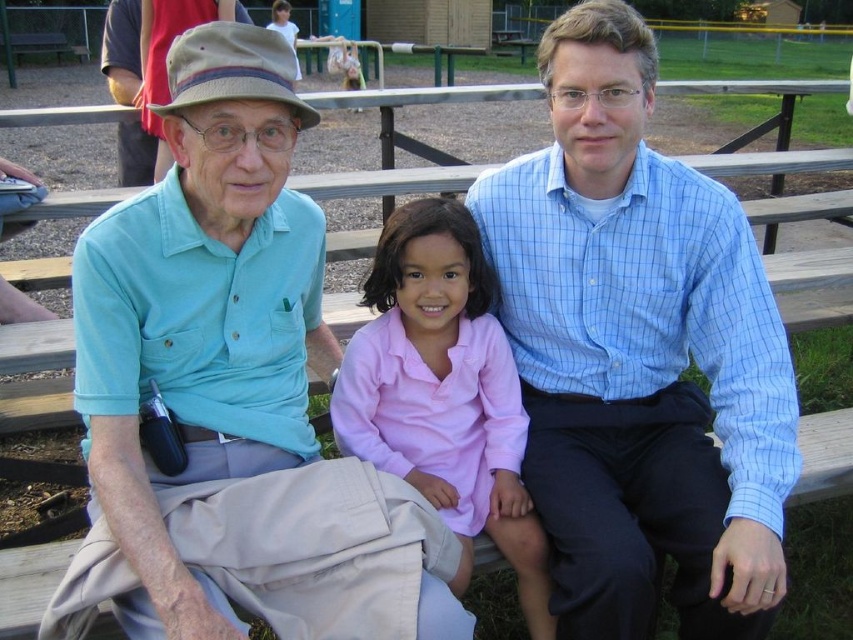
You are a photographer trying to capture a group photo of the blue checkered shirt at center and the pink cotton shirt at center. Since you want to ensure both shirts are clearly visible, which shirt should you focus on first to account for their sizes?

The blue checkered shirt at center is wider than the pink cotton shirt at center, so you should focus on the blue checkered shirt at center first to ensure its full width is captured clearly.

You are a photographer setting up a tripod to take a group photo of the light blue shirt at left and the pink cotton shirt at center. The tripod has a width of 1.2 meters. Is the space between them sufficient for the tripod?

The light blue shirt at left might be wider than the pink cotton shirt at center, but the exact distance isn not provided. Without knowing the actual spacing, it is uncertain if the 1.2 meter tripod will fit between them.